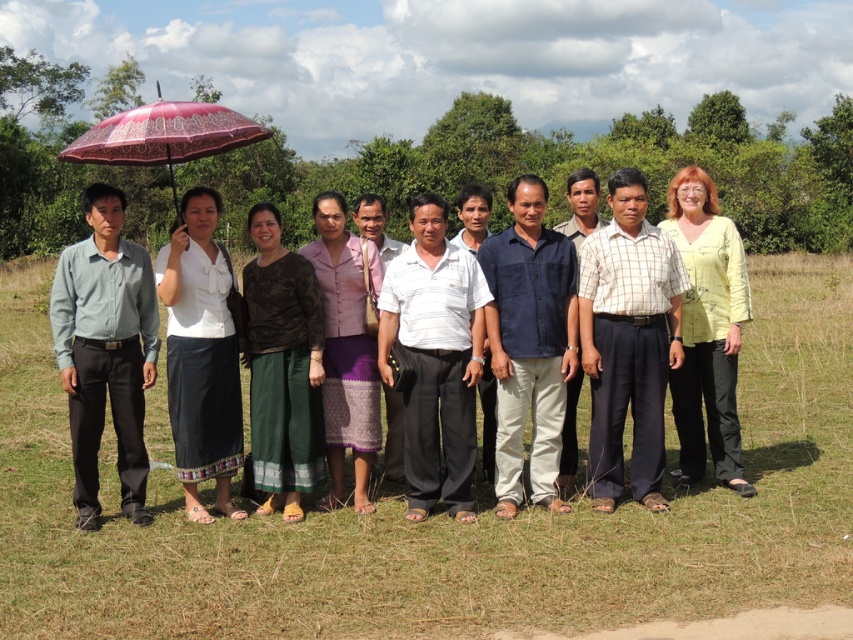
You are a photographer trying to capture a group photo. You notice the white woven skirt at center and the light yellow fabric at center in the scene. Which one is positioned to the left of the other?

The white woven skirt at center is to the left of the light yellow fabric at center.

You are a photographer trying to capture a group photo where all skirts are visible. Given that the dark green woven skirt at center and the purple woven skirt at center are both at the center, which skirt might require more space to the sides to ensure it doesn not overlap with others?

The dark green woven skirt at center requires more space to the sides because its width is larger than the purple woven skirt at center.